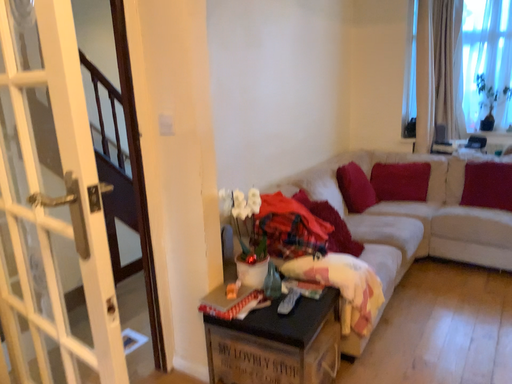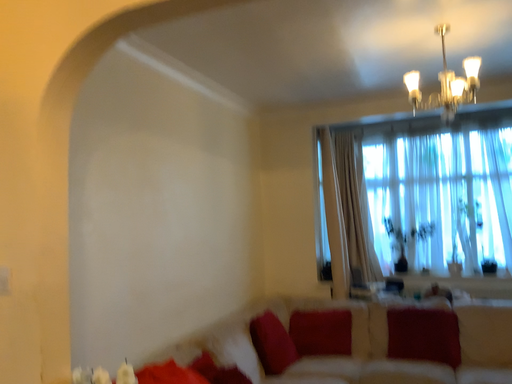
Question: Which way did the camera rotate in the video?

Choices:
 (A) rotated left
 (B) rotated right

Answer: (B)